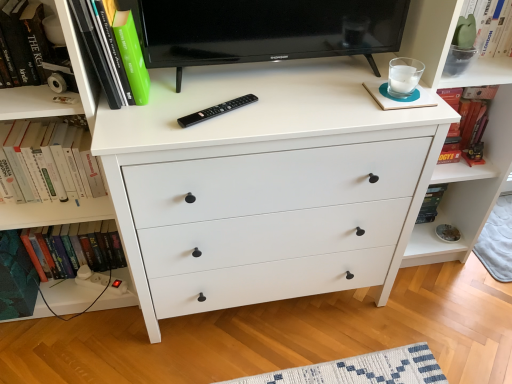
Find the location of a particular element. Image resolution: width=512 pixels, height=384 pixels. white matte chest of drawers at center is located at coordinates (265, 184).

In order to face hardcover book at left, acting as the second book starting from the top, should I rotate leftwards or rightwards?

Rotate your view left by about 27.016°.

Locate an element on the screen. This screenshot has height=384, width=512. white plastic plug at lower left is located at coordinates (100, 281).

In order to face black glossy tv at upper center, should I rotate leftwards or rightwards?

Turn right approximately 3.225 degrees to face it.

Identify the location of green matte book at upper left, which appears as the third book when ordered from the bottom. (113, 51).

Is teal matte book at left located outside white matte chest of drawers at center?

Yes, teal matte book at left is outside of white matte chest of drawers at center.

Considering the relative positions of teal matte book at left and white matte chest of drawers at center in the image provided, is teal matte book at left to the left of white matte chest of drawers at center from the viewer's perspective?

Yes, teal matte book at left is to the left of white matte chest of drawers at center.

Consider the image. Is the position of teal matte book at left more distant than that of white matte chest of drawers at center?

Yes, teal matte book at left is behind white matte chest of drawers at center.

Could you tell me if teal matte book at left is facing white matte chest of drawers at center?

No, teal matte book at left is not aimed at white matte chest of drawers at center.

Which is closer, (109, 283) or (79, 134)?

Point (109, 283) is positioned farther from the camera compared to point (79, 134).

Is white plastic plug at lower left situated inside hardcover book at left, acting as the second book starting from the top, or outside?

white plastic plug at lower left is located beyond the bounds of hardcover book at left, acting as the second book starting from the top.

Between white plastic plug at lower left and hardcover book at left, acting as the second book starting from the top, which one is positioned in front?

hardcover book at left, acting as the second book starting from the top, is closer to the camera.

Image resolution: width=512 pixels, height=384 pixels. Identify the location of plug below the hardcover book at left, which is the first book from bottom to top (from the image's perspective). (100, 281).

Is hardcover book at left, which is the first book from bottom to top, not inside white plastic plug at lower left?

Yes, hardcover book at left, which is the first book from bottom to top, is outside of white plastic plug at lower left.

Is hardcover book at left, which is the third book from top to bottom, looking in the opposite direction of white plastic plug at lower left?

No, hardcover book at left, which is the third book from top to bottom,'s orientation is not away from white plastic plug at lower left.

Which point is more distant from viewer, (481, 72) or (42, 148)?

Point (42, 148)

From the image's perspective, is green matte plant at upper right located above hardcover book at left, acting as the second book starting from the top?

Indeed, from the image's perspective, green matte plant at upper right is shown above hardcover book at left, acting as the second book starting from the top.

Does green matte plant at upper right come in front of hardcover book at left, acting as the second book starting from the top?

No, green matte plant at upper right is behind hardcover book at left, acting as the second book starting from the top.

Is green matte plant at upper right in contact with hardcover book at left, acting as the second book starting from the top?

No, green matte plant at upper right is not touching hardcover book at left, acting as the second book starting from the top.

From a real-world perspective, is black plastic remote at center under hardcover book at left, acting as the second book starting from the top?

Actually, black plastic remote at center is physically above hardcover book at left, acting as the second book starting from the top, in the real world.

How different are the orientations of black plastic remote at center and hardcover book at left, acting as the second book starting from the top, in degrees?

The angular difference between black plastic remote at center and hardcover book at left, acting as the second book starting from the top, is 61.4 degrees.

Can you confirm if black plastic remote at center is smaller than hardcover book at left, acting as the second book starting from the top?

Correct, black plastic remote at center occupies less space than hardcover book at left, acting as the second book starting from the top.

Is black plastic remote at center not close to hardcover book at left, acting as the second book starting from the top?

No, black plastic remote at center is not far from hardcover book at left, acting as the second book starting from the top.

The height and width of the screenshot is (384, 512). I want to click on shelf above the white matte chest of drawers at center (from the image's perspective), so click(x=482, y=74).

Between green matte plant at upper right and white matte chest of drawers at center, which one has more height?

With more height is white matte chest of drawers at center.

How far apart are green matte plant at upper right and white matte chest of drawers at center?

A distance of 22.95 inches exists between green matte plant at upper right and white matte chest of drawers at center.

Can you tell me how much green matte plant at upper right and white matte chest of drawers at center differ in facing direction?

There is a 0.543-degree angle between the facing directions of green matte plant at upper right and white matte chest of drawers at center.

Which object is positioned more to the left, black plastic remote at center or white plastic plug at lower left?

Positioned to the left is white plastic plug at lower left.

Can you confirm if black plastic remote at center is shorter than white plastic plug at lower left?

Correct, black plastic remote at center is not as tall as white plastic plug at lower left.

Could you tell me if black plastic remote at center is facing white plastic plug at lower left?

No, black plastic remote at center is not facing towards white plastic plug at lower left.

Considering the sizes of objects black plastic remote at center and white plastic plug at lower left in the image provided, who is smaller, black plastic remote at center or white plastic plug at lower left?

black plastic remote at center is smaller.

Locate an element on the screen. This screenshot has height=384, width=512. the chest of drawers that appears above the teal matte book at left (from the image's perspective) is located at coordinates (265, 184).

Where is `plug on the right of hardcover book at left, which is counted as the second book, starting from the bottom`? plug on the right of hardcover book at left, which is counted as the second book, starting from the bottom is located at coordinates (100, 281).

Looking at this image, estimate the real-world distances between objects in this image. Which object is closer to black glossy tv at upper center, black plastic remote at center or hardcover book at left, acting as the second book starting from the top?

black plastic remote at center.

When comparing their distances from black plastic remote at center, does white matte chest of drawers at center or teal matte book at left seem closer?

white matte chest of drawers at center is closer to black plastic remote at center.

Which object lies nearer to the anchor point green matte book at upper left, which appears as the third book when ordered from the bottom, hardcover book at left, which is the first book from bottom to top, or black glossy tv at upper center?

Based on the image, black glossy tv at upper center appears to be nearer to green matte book at upper left, which appears as the third book when ordered from the bottom.

From the image, which object appears to be farther from black glossy tv at upper center, white plastic plug at lower left or teal matte book at left?

Based on the image, white plastic plug at lower left appears to be further to black glossy tv at upper center.

Looking at the image, which one is located further to green matte plant at upper right, teal matte book at left or black glossy tv at upper center?

teal matte book at left lies further to green matte plant at upper right than the other object.

Which object lies further to the anchor point hardcover book at left, acting as the second book starting from the top, teal matte book at left or black glossy tv at upper center?

black glossy tv at upper center lies further to hardcover book at left, acting as the second book starting from the top, than the other object.

Estimate the real-world distances between objects in this image. Which object is closer to hardcover book at left, acting as the second book starting from the top, black plastic remote at center or white matte chest of drawers at center?

black plastic remote at center.

Considering their positions, is teal matte book at left positioned further to black plastic remote at center than black glossy tv at upper center?

teal matte book at left is further to black plastic remote at center.

In order to click on plug between teal matte book at left and black glossy tv at upper center in this screenshot , I will do `click(100, 281)`.

Find the location of a particular element. This screenshot has height=384, width=512. remote between green matte book at upper left, the first book from the top, and green matte plant at upper right from left to right is located at coordinates (216, 110).

You are a GUI agent. You are given a task and a screenshot of the screen. Output one action in this format:
    pyautogui.click(x=<x>, y=<y>)
    Task: Click on the remote between hardcover book at left, which is the third book from top to bottom, and black glossy tv at upper center
    
    Given the screenshot: What is the action you would take?
    pyautogui.click(x=216, y=110)

Image resolution: width=512 pixels, height=384 pixels. In order to click on paperback book that lies between hardcover book at left, acting as the second book starting from the top, and white plastic plug at lower left from top to bottom in this screenshot , I will do `click(16, 278)`.